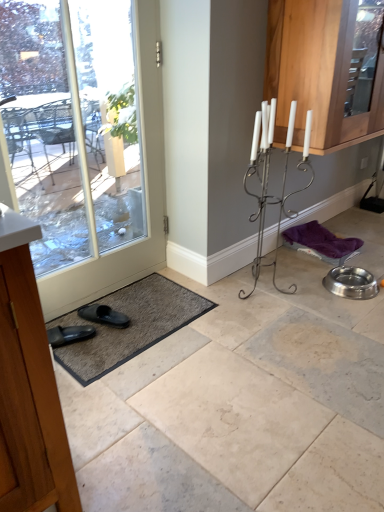
At what (x,y) coordinates should I click in order to perform the action: click on vacant region to the right of gray textured bath mat at lower left. Please return your answer as a coordinate pair (x, y). The height and width of the screenshot is (512, 384). Looking at the image, I should click on (260, 335).